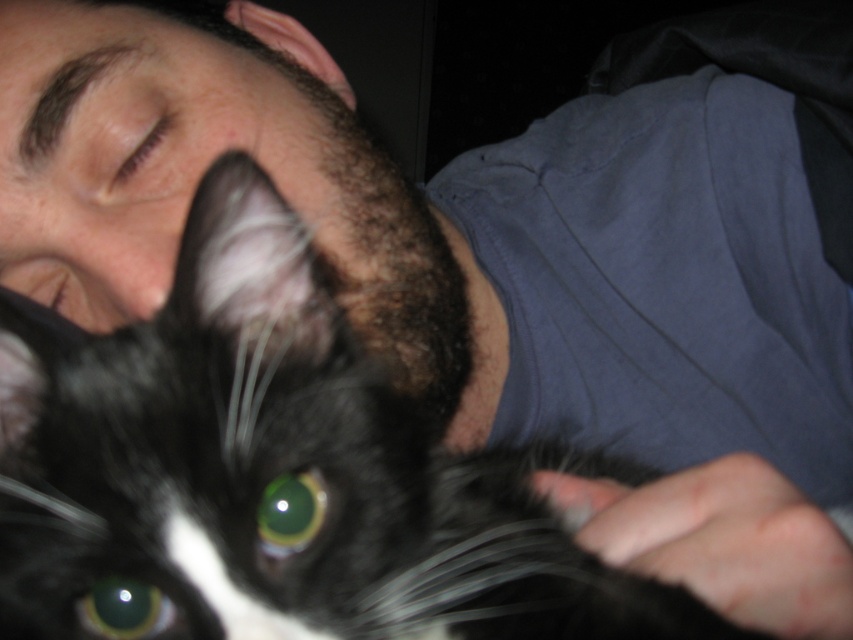
Question: Which object is closer to the camera taking this photo?

Choices:
 (A) green glossy eye at center
 (B) black fur at center
 (C) black fur cat at center

Answer: (C)

Question: From the image, what is the correct spatial relationship of black fur at center in relation to brown fur at upper left?

Choices:
 (A) right
 (B) left

Answer: (A)

Question: Does green glossy eye at lower left appear on the right side of brown fur at upper left?

Choices:
 (A) no
 (B) yes

Answer: (B)

Question: Does black fur at center have a smaller size compared to green glossy eye at lower left?

Choices:
 (A) no
 (B) yes

Answer: (A)

Question: Which of the following is the farthest from the observer?

Choices:
 (A) (x=102, y=614)
 (B) (x=326, y=486)
 (C) (x=535, y=497)
 (D) (x=178, y=116)

Answer: (D)

Question: Considering the real-world distances, which object is closest to the black fur at center?

Choices:
 (A) black fur cat at center
 (B) green glossy eye at center

Answer: (A)